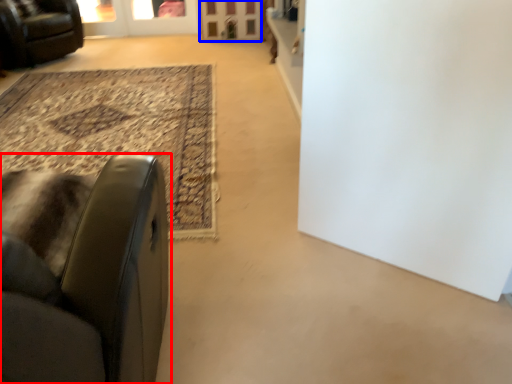
Question: Which object appears farthest to the camera in this image, chair (highlighted by a red box) or screen door (highlighted by a blue box)?

Choices:
 (A) chair
 (B) screen door

Answer: (B)